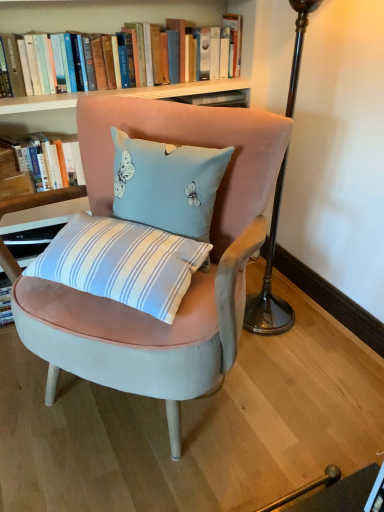
Question: Which direction should I rotate to look at hardcover books at upper center, marked as the 1th book in a top-to-bottom arrangement?

Choices:
 (A) left
 (B) right

Answer: (A)

Question: Should I look upward or downward to see velvet pink chair at center?

Choices:
 (A) down
 (B) up

Answer: (A)

Question: Are hardcover books at upper center, marked as the 1th book in a top-to-bottom arrangement, and hardcover book at upper left, which is counted as the 2th book, starting from the top, making contact?

Choices:
 (A) yes
 (B) no

Answer: (B)

Question: Considering the relative sizes of hardcover books at upper center, marked as the 1th book in a top-to-bottom arrangement, and hardcover book at upper left, which is counted as the 2th book, starting from the top, in the image provided, is hardcover books at upper center, marked as the 1th book in a top-to-bottom arrangement, thinner than hardcover book at upper left, which is counted as the 2th book, starting from the top,?

Choices:
 (A) no
 (B) yes

Answer: (B)

Question: Considering the relative sizes of hardcover books at upper center, the second book in the bottom-to-top sequence, and hardcover book at upper left, positioned as the first book in bottom-to-top order, in the image provided, is hardcover books at upper center, the second book in the bottom-to-top sequence, taller than hardcover book at upper left, positioned as the first book in bottom-to-top order,?

Choices:
 (A) yes
 (B) no

Answer: (A)

Question: Is hardcover books at upper center, the second book in the bottom-to-top sequence, not inside hardcover book at upper left, which is counted as the 2th book, starting from the top?

Choices:
 (A) no
 (B) yes

Answer: (B)

Question: From the image's perspective, is hardcover books at upper center, the second book in the bottom-to-top sequence, located beneath hardcover book at upper left, which is counted as the 2th book, starting from the top?

Choices:
 (A) yes
 (B) no

Answer: (B)

Question: From a real-world perspective, is hardcover books at upper center, marked as the 1th book in a top-to-bottom arrangement, positioned over hardcover book at upper left, which is counted as the 2th book, starting from the top, based on gravity?

Choices:
 (A) yes
 (B) no

Answer: (A)

Question: Is hardcover book at upper left, which is counted as the 2th book, starting from the top, oriented away from light blue velvet cushion at center?

Choices:
 (A) yes
 (B) no

Answer: (B)

Question: Is hardcover book at upper left, positioned as the first book in bottom-to-top order, thinner than light blue velvet cushion at center?

Choices:
 (A) yes
 (B) no

Answer: (A)

Question: Considering the relative positions of hardcover book at upper left, positioned as the first book in bottom-to-top order, and light blue velvet cushion at center in the image provided, is hardcover book at upper left, positioned as the first book in bottom-to-top order, to the right of light blue velvet cushion at center from the viewer's perspective?

Choices:
 (A) yes
 (B) no

Answer: (B)

Question: Does hardcover book at upper left, which is counted as the 2th book, starting from the top, have a larger size compared to light blue velvet cushion at center?

Choices:
 (A) no
 (B) yes

Answer: (A)

Question: Is hardcover book at upper left, positioned as the first book in bottom-to-top order, not within light blue velvet cushion at center?

Choices:
 (A) no
 (B) yes

Answer: (B)

Question: Is hardcover book at upper left, positioned as the first book in bottom-to-top order, aimed at light blue velvet cushion at center?

Choices:
 (A) yes
 (B) no

Answer: (A)

Question: Considering the relative sizes of velvet pink chair at center and hardcover book at upper left, which is counted as the 2th book, starting from the top, in the image provided, is velvet pink chair at center smaller than hardcover book at upper left, which is counted as the 2th book, starting from the top,?

Choices:
 (A) no
 (B) yes

Answer: (A)